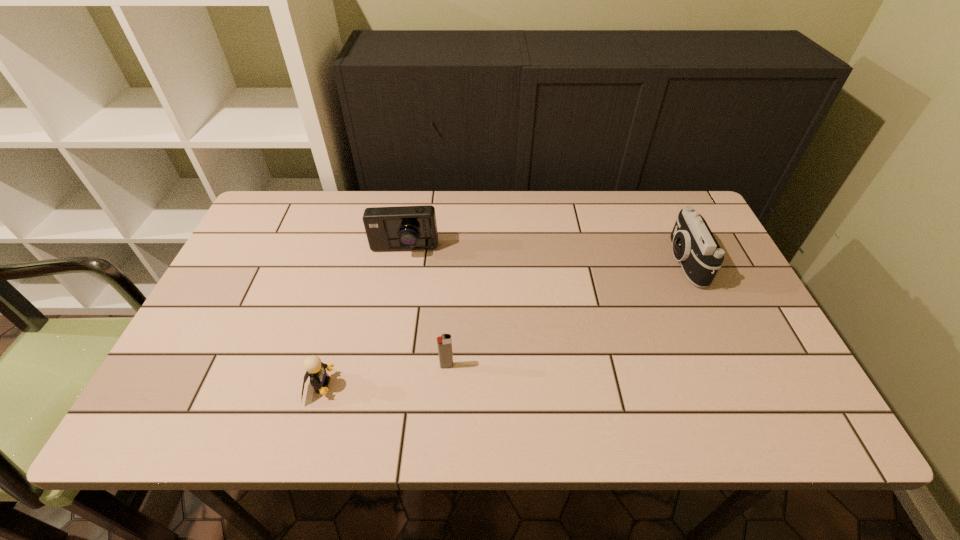
This screenshot has width=960, height=540. Identify the location of blank area in the image that satisfies the following two spatial constraints: 1. on the front-facing side of the third object from left to right; 2. on the left side of the second object from left to right. (383, 366).

The image size is (960, 540). What are the coordinates of `free point that satisfies the following two spatial constraints: 1. on the front-facing side of the left camera; 2. on the front-facing side of the leftmost object` in the screenshot? It's located at (380, 386).

Locate an element on the screen. This screenshot has height=540, width=960. vacant space that satisfies the following two spatial constraints: 1. on the front-facing side of the left camera; 2. on the front-facing side of the Lego is located at coordinates (380, 386).